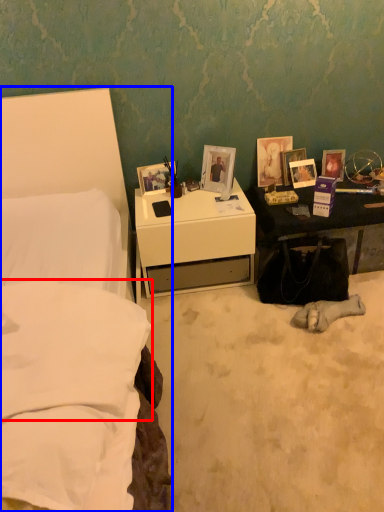
Question: Which point is closer to the camera, pillow (highlighted by a red box) or bed (highlighted by a blue box)?

Choices:
 (A) pillow
 (B) bed

Answer: (B)